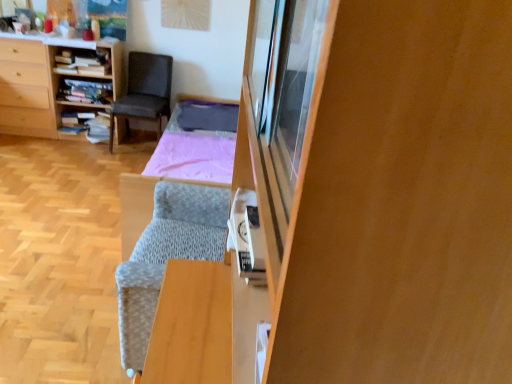
Find the location of `vacant space in front of wooden bookshelf at left, which appears as the third shelf when viewed from the top`. vacant space in front of wooden bookshelf at left, which appears as the third shelf when viewed from the top is located at coordinates (77, 147).